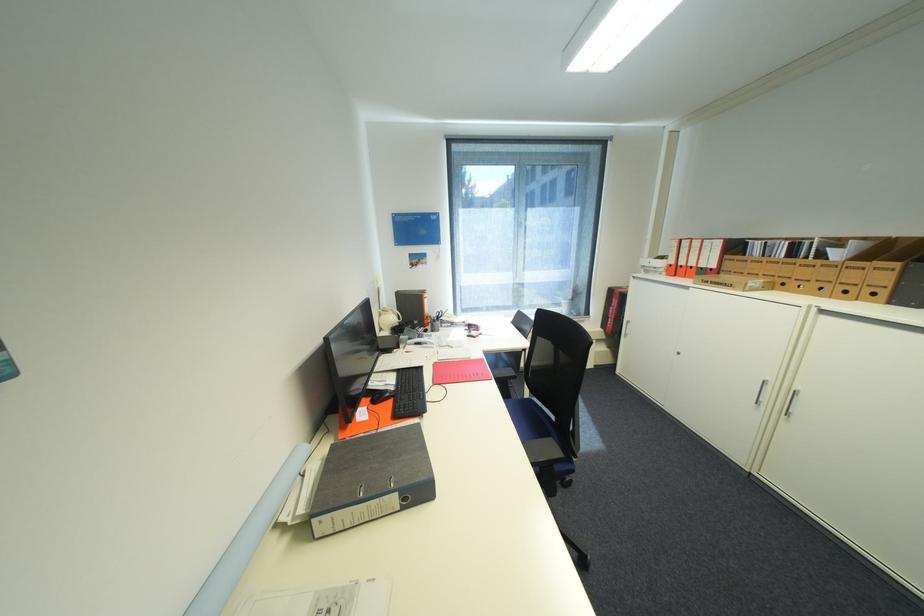
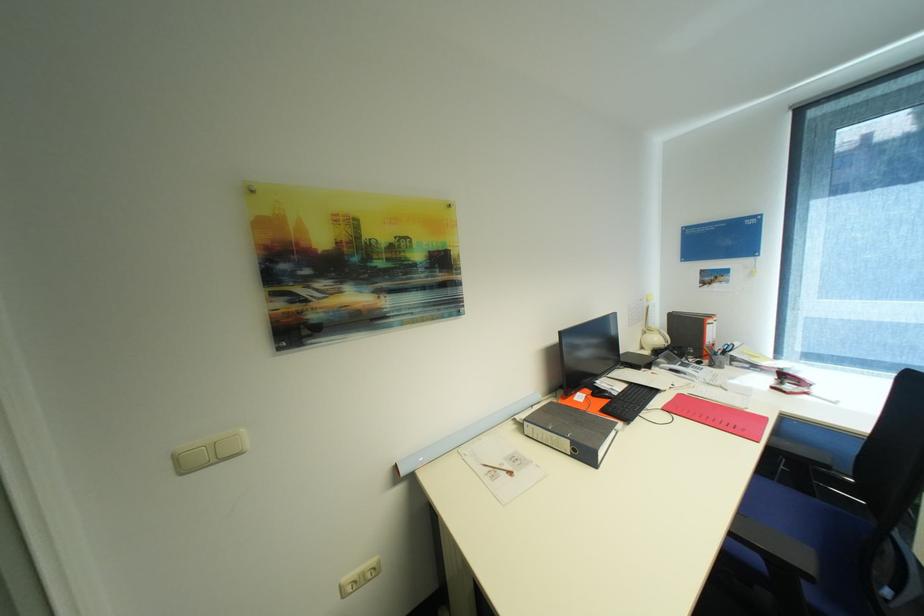
Question: I am providing you with two images of the same scene from different viewpoints. Please identify which objects are invisible in image2.

Choices:
 (A) white phone handset
 (B) black keyboard
 (C) chair sitting surface
 (D) none of these

Answer: (D)